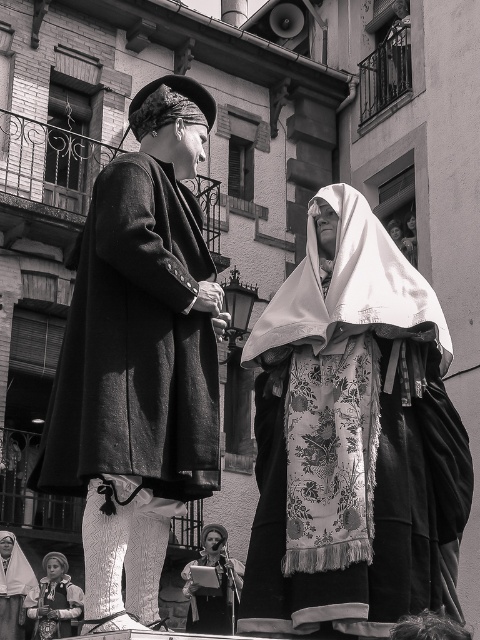
Question: Which point is farther from the camera taking this photo?

Choices:
 (A) (20, 620)
 (B) (99, 228)
 (C) (335, 301)

Answer: (A)

Question: Which object appears farthest from the camera in this image?

Choices:
 (A) floral fabric shawl at center
 (B) floral fabric robe at center

Answer: (B)

Question: Does floral fabric robe at lower left have a larger size compared to floral fabric dress at center?

Choices:
 (A) no
 (B) yes

Answer: (B)

Question: Is floral fabric shawl at center positioned before matte black coat at left?

Choices:
 (A) no
 (B) yes

Answer: (A)

Question: Among these objects, which one is nearest to the camera?

Choices:
 (A) floral fabric robe at lower left
 (B) matte black coat at left

Answer: (B)

Question: Can you confirm if floral fabric robe at center is positioned to the left of floral fabric dress at center?

Choices:
 (A) yes
 (B) no

Answer: (B)